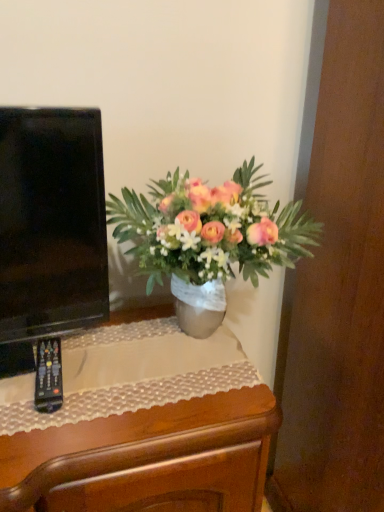
Question: Is the depth of wooden desk at center greater than that of black plastic remote at lower left?

Choices:
 (A) no
 (B) yes

Answer: (A)

Question: Does wooden desk at center touch black plastic remote at lower left?

Choices:
 (A) yes
 (B) no

Answer: (B)

Question: From the image's perspective, would you say wooden desk at center is shown under black plastic remote at lower left?

Choices:
 (A) yes
 (B) no

Answer: (A)

Question: Considering the relative sizes of wooden desk at center and black plastic remote at lower left in the image provided, is wooden desk at center wider than black plastic remote at lower left?

Choices:
 (A) no
 (B) yes

Answer: (B)

Question: Is wooden desk at center not inside black plastic remote at lower left?

Choices:
 (A) yes
 (B) no

Answer: (A)

Question: From a real-world perspective, is wooden desk at center located beneath black plastic remote at lower left?

Choices:
 (A) yes
 (B) no

Answer: (A)

Question: Considering the relative sizes of metallic silver vase at center and black plastic remote at lower left in the image provided, is metallic silver vase at center thinner than black plastic remote at lower left?

Choices:
 (A) yes
 (B) no

Answer: (B)

Question: Could you tell me if metallic silver vase at center is turned towards black plastic remote at lower left?

Choices:
 (A) no
 (B) yes

Answer: (A)

Question: Is metallic silver vase at center located outside black plastic remote at lower left?

Choices:
 (A) no
 (B) yes

Answer: (B)

Question: From the image's perspective, is metallic silver vase at center on top of black plastic remote at lower left?

Choices:
 (A) no
 (B) yes

Answer: (B)

Question: Is metallic silver vase at center further to camera compared to black plastic remote at lower left?

Choices:
 (A) no
 (B) yes

Answer: (A)

Question: Is metallic silver vase at center turned away from black plastic remote at lower left?

Choices:
 (A) no
 (B) yes

Answer: (A)

Question: Does wooden desk at center turn towards metallic silver vase at center?

Choices:
 (A) yes
 (B) no

Answer: (B)